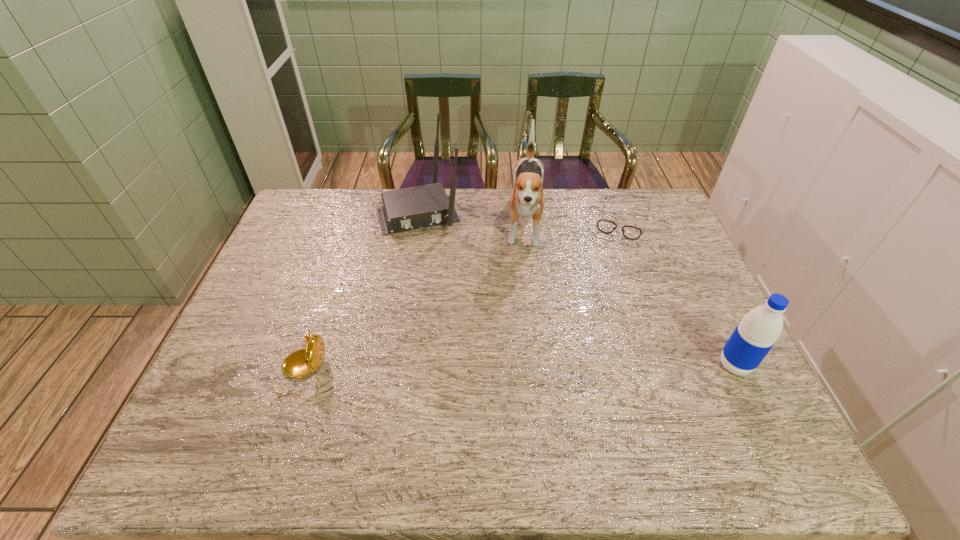
Find the location of a particular element. This screenshot has width=960, height=540. free space located on the back of the third shortest object is located at coordinates (691, 274).

The width and height of the screenshot is (960, 540). I want to click on vacant space located 0.110m on the front-facing side of the fourth object from left to right, so click(610, 261).

This screenshot has width=960, height=540. What are the coordinates of `free location located 0.090m on the front-facing side of the fourth object from left to right` in the screenshot? It's located at (611, 257).

Identify the location of vacant space located on the front-facing side of the fourth object from left to right. The width and height of the screenshot is (960, 540). (609, 264).

Find the location of `vacant space located at the face of the puppy`. vacant space located at the face of the puppy is located at coordinates (525, 312).

This screenshot has height=540, width=960. Identify the location of free space located 0.240m at the face of the puppy. (524, 326).

Find the location of a particular element. Image resolution: width=960 pixels, height=540 pixels. vacant region located 0.330m at the face of the puppy is located at coordinates (523, 353).

At what (x,y) coordinates should I click in order to perform the action: click on vacant area located 0.270m on the back of the router to connect cables. Please return your answer as a coordinate pair (x, y). Looking at the image, I should click on (447, 293).

Where is `vacant region located 0.190m on the back of the router to connect cables`? The image size is (960, 540). vacant region located 0.190m on the back of the router to connect cables is located at coordinates (441, 274).

Find the location of a particular element. This screenshot has height=540, width=960. vacant space situated 0.090m on the back of the router to connect cables is located at coordinates (434, 252).